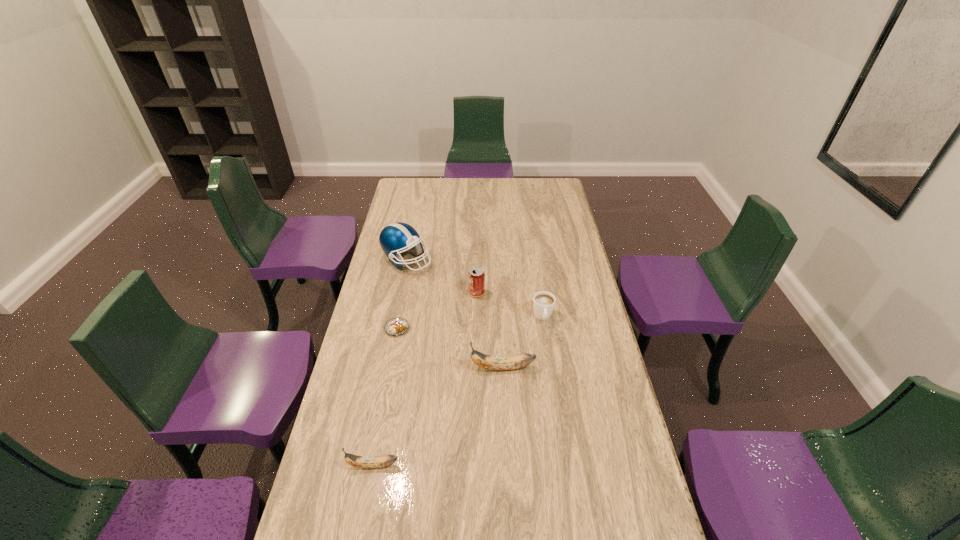
Locate an element on the screen. The width and height of the screenshot is (960, 540). vacant space situated on the peel of the taller banana is located at coordinates (398, 368).

At what (x,y) coordinates should I click in order to perform the action: click on vacant area located 0.250m on the peel of the taller banana. Please return your answer as a coordinate pair (x, y). The image size is (960, 540). Looking at the image, I should click on (396, 368).

You are a GUI agent. You are given a task and a screenshot of the screen. Output one action in this format:
    pyautogui.click(x=<x>, y=<y>)
    Task: Click on the vacant space located on the left of the second farthest object
    The image size is (960, 540).
    Given the screenshot: What is the action you would take?
    pyautogui.click(x=412, y=293)

What are the coordinates of `free space located at the front of the farthest object with the faceguard` in the screenshot? It's located at (482, 260).

Where is `vacant space located with the handle on the side of the cappuccino`? vacant space located with the handle on the side of the cappuccino is located at coordinates (548, 353).

The width and height of the screenshot is (960, 540). In order to click on free spot located on the front of the pastry in this screenshot , I will do `click(384, 397)`.

Locate an element on the screen. banana at the left edge is located at coordinates (367, 462).

I want to click on football helmet positioned at the left edge, so click(395, 238).

Find the location of a particular element. This screenshot has width=960, height=540. pastry that is at the left edge is located at coordinates (396, 326).

At what (x,y) coordinates should I click in order to perform the action: click on free space at the far edge. Please return your answer as a coordinate pair (x, y). Looking at the image, I should click on (489, 200).